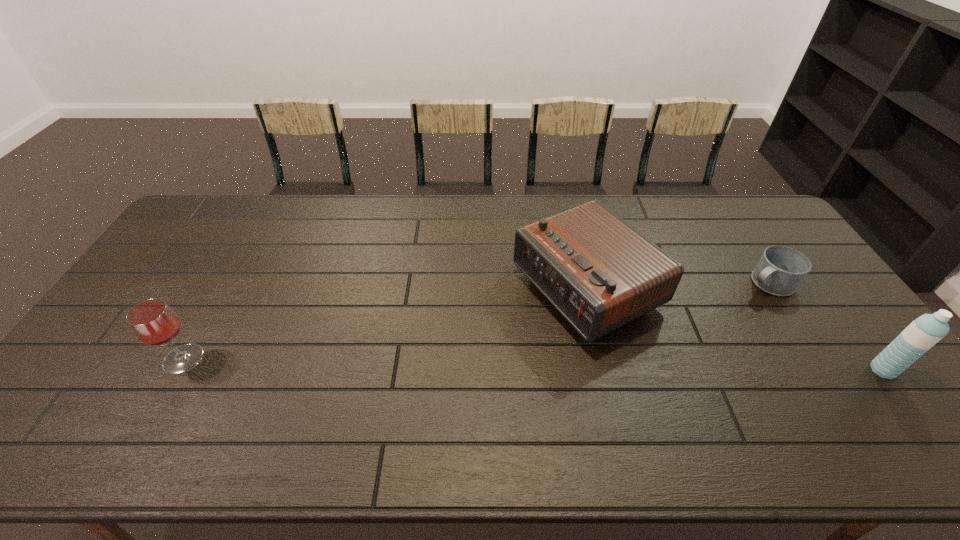
Image resolution: width=960 pixels, height=540 pixels. What are the coordinates of `free space located 0.060m on the tuning display of the radio receiver` in the screenshot? It's located at pyautogui.click(x=509, y=328).

Where is `free space located 0.050m on the tuning display of the radio receiver`? The image size is (960, 540). free space located 0.050m on the tuning display of the radio receiver is located at coordinates (512, 326).

Image resolution: width=960 pixels, height=540 pixels. Find the location of `vacant space located on the tuning display of the radio receiver`. vacant space located on the tuning display of the radio receiver is located at coordinates (512, 326).

The height and width of the screenshot is (540, 960). I want to click on water bottle that is at the right edge, so click(924, 332).

Find the location of a particular element. This screenshot has width=960, height=540. mug that is at the right edge is located at coordinates (781, 269).

In the image, there is a desktop. Identify the location of vacant space at the far edge. (478, 206).

The height and width of the screenshot is (540, 960). I want to click on free space at the near edge of the desktop, so click(x=605, y=397).

In the image, there is a desktop. Identify the location of vacant space at the left edge. (119, 351).

Where is `free spot between the wineglass and the second object from left to right`? free spot between the wineglass and the second object from left to right is located at coordinates (385, 325).

Locate an element on the screen. vacant space in between the wineglass and the rightmost object is located at coordinates (533, 364).